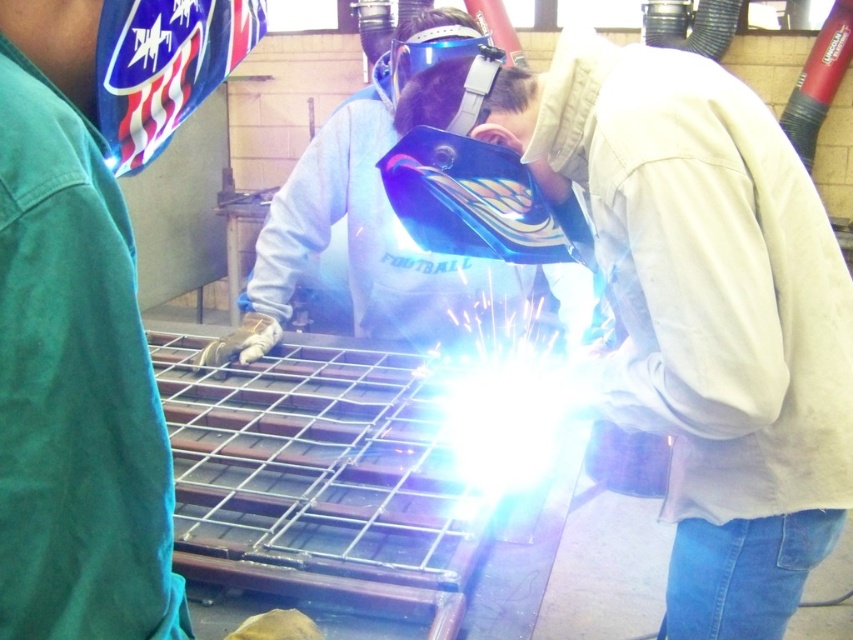
Can you confirm if matte white welding helmet at upper center is positioned to the left of transparent plastic welding mask at center?

Correct, you'll find matte white welding helmet at upper center to the left of transparent plastic welding mask at center.

Does matte white welding helmet at upper center have a lesser height compared to transparent plastic welding mask at center?

Incorrect, matte white welding helmet at upper center's height does not fall short of transparent plastic welding mask at center's.

At what (x,y) coordinates should I click in order to perform the action: click on matte white welding helmet at upper center. Please return your answer as a coordinate pair (x, y). Looking at the image, I should click on (90, 307).

Does matte blue welding helmet at center have a lesser width compared to matte white welding helmet at upper center?

In fact, matte blue welding helmet at center might be wider than matte white welding helmet at upper center.

Is matte blue welding helmet at center shorter than matte white welding helmet at upper center?

No.

Which is behind, point (775, 529) or point (74, 88)?

Positioned behind is point (775, 529).

At what (x,y) coordinates should I click in order to perform the action: click on matte blue welding helmet at center. Please return your answer as a coordinate pair (x, y). This screenshot has height=640, width=853. Looking at the image, I should click on (704, 312).

Does matte blue welding helmet at center have a greater height compared to blue reflective welding helmet at center?

Yes, matte blue welding helmet at center is taller than blue reflective welding helmet at center.

Which is in front, point (744, 618) or point (370, 189)?

Point (744, 618) is more forward.

The height and width of the screenshot is (640, 853). In order to click on matte blue welding helmet at center in this screenshot , I will do `click(704, 312)`.